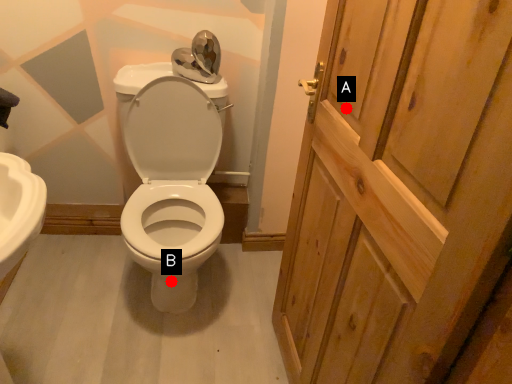
Question: Two points are circled on the image, labeled by A and B beside each circle. Which point appears closest to the camera in this image?

Choices:
 (A) A is closer
 (B) B is closer

Answer: (A)